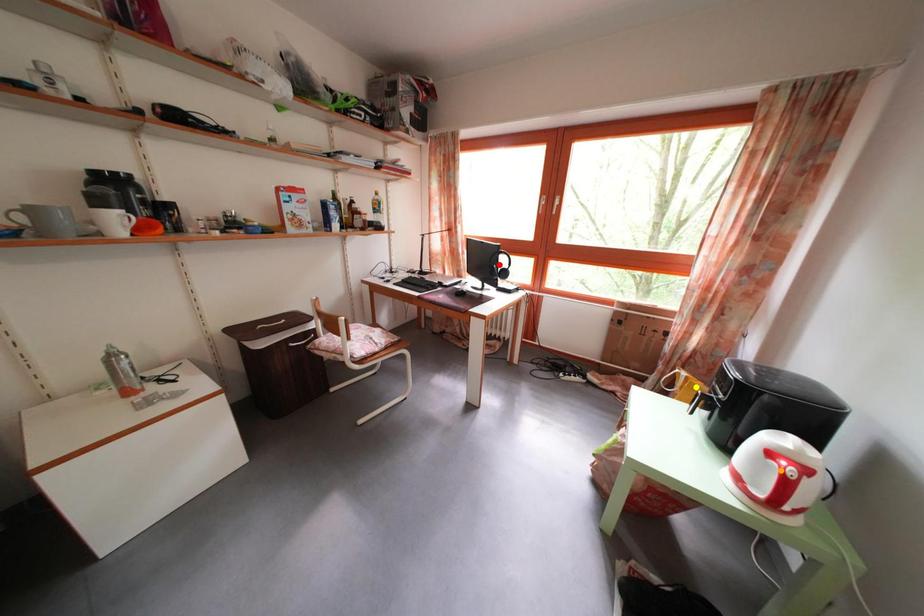
Order these from nearest to farthest:
- yellow point
- red point
- orange point

orange point
yellow point
red point